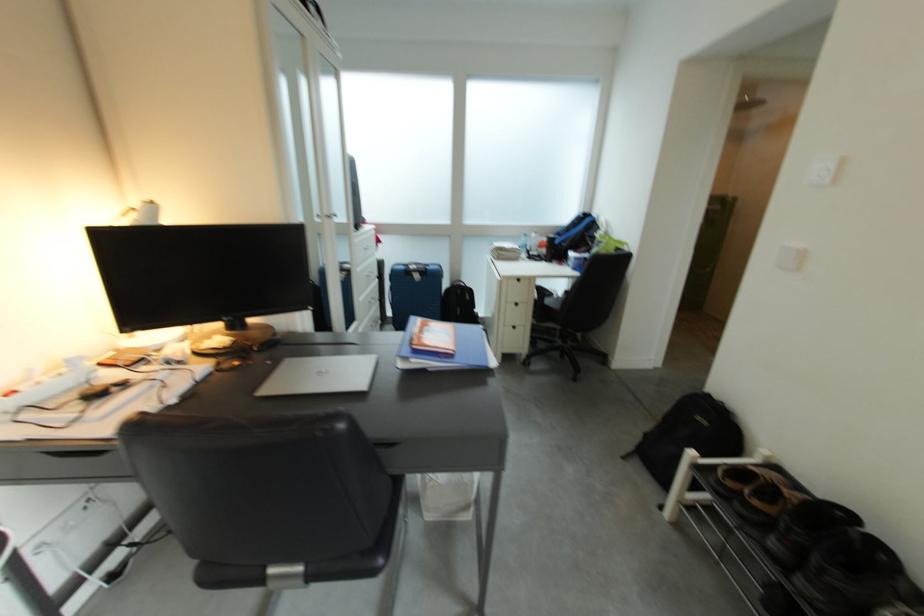
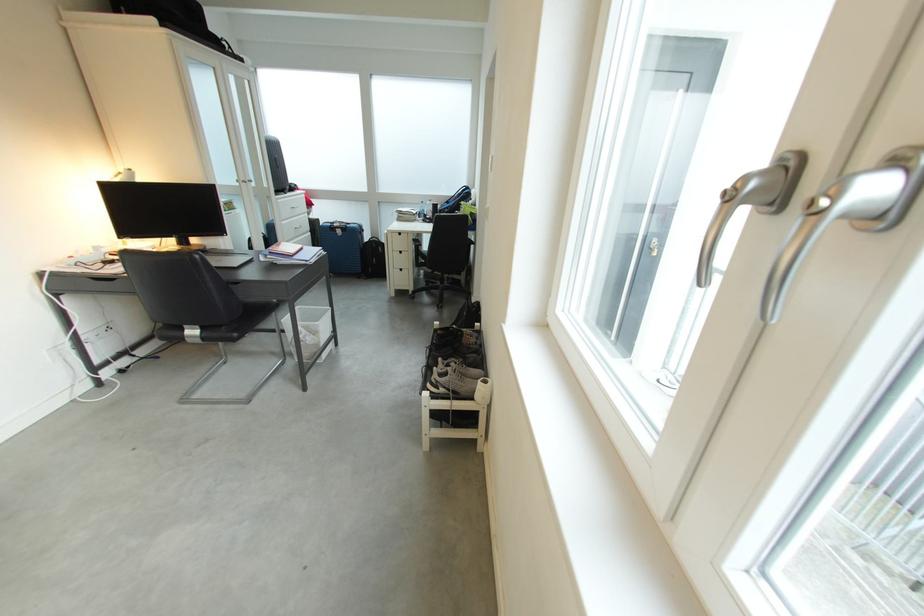
Locate, in the second image, the point that corresponds to pixel 429 280 in the first image.

(350, 235)